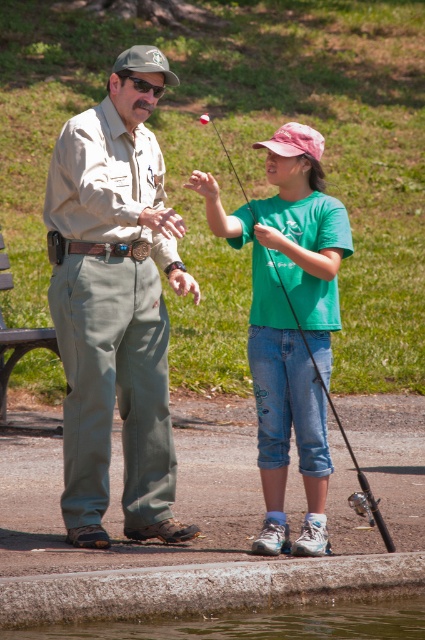
Question: Estimate the real-world distances between objects in this image. Which object is farther from the greenish water at lower center?

Choices:
 (A) black plastic fishing pole at center
 (B) khaki uniform at center

Answer: (A)

Question: Which point is farther to the camera?

Choices:
 (A) (241, 188)
 (B) (116, 296)
 (C) (263, 637)

Answer: (A)

Question: Can you confirm if greenish water at lower center is positioned to the left of black plastic fishing pole at center?

Choices:
 (A) no
 (B) yes

Answer: (B)

Question: Which object appears closest to the camera in this image?

Choices:
 (A) khaki uniform at center
 (B) greenish water at lower center

Answer: (B)

Question: Does greenish water at lower center come behind black plastic fishing pole at center?

Choices:
 (A) no
 (B) yes

Answer: (A)

Question: Does khaki uniform at center appear over black plastic fishing pole at center?

Choices:
 (A) yes
 (B) no

Answer: (B)